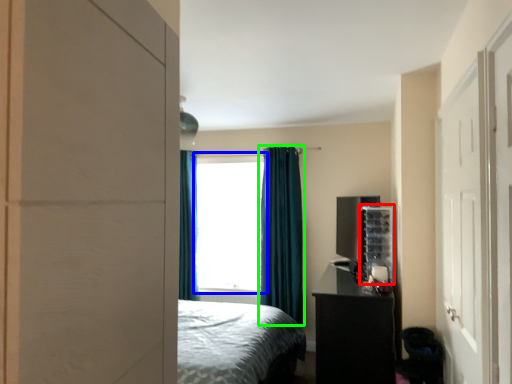
Question: Which object is positioned closest to shelf (highlighted by a red box)? Select from window (highlighted by a blue box) and curtain (highlighted by a green box).

Choices:
 (A) window
 (B) curtain

Answer: (B)